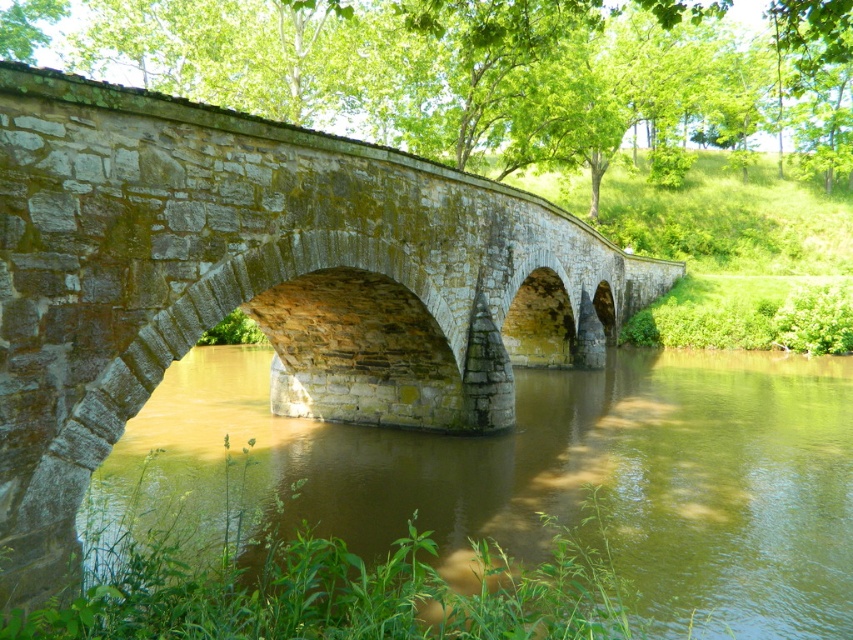
Looking at this image, who is higher up, gray stone bridge at center or brown stone river at center?

gray stone bridge at center is higher up.

Between point (456, 262) and point (613, 486), which one is positioned behind?

The point (456, 262) is behind.

This screenshot has width=853, height=640. What do you see at coordinates (259, 284) in the screenshot?
I see `gray stone bridge at center` at bounding box center [259, 284].

At what (x,y) coordinates should I click in order to perform the action: click on gray stone bridge at center. Please return your answer as a coordinate pair (x, y). This screenshot has width=853, height=640. Looking at the image, I should click on (259, 284).